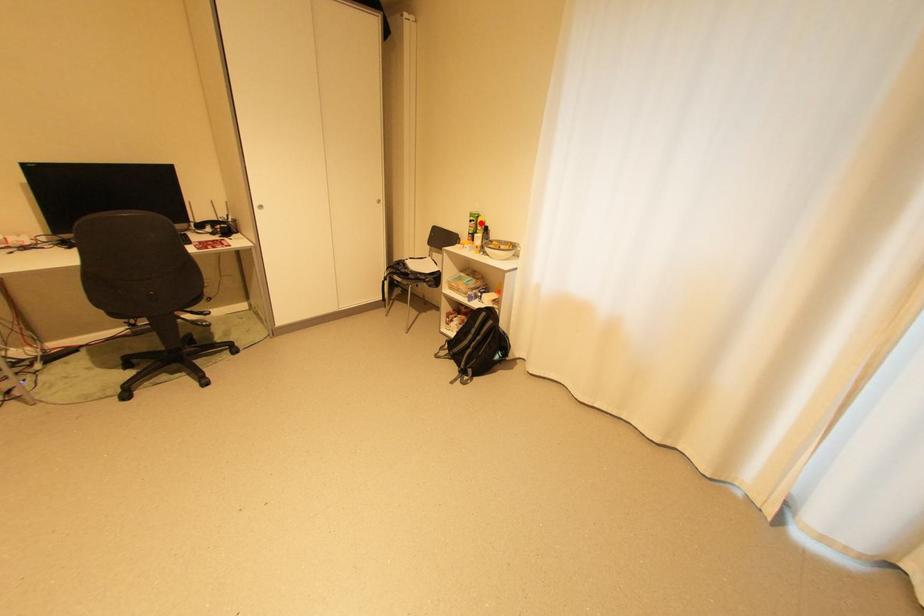
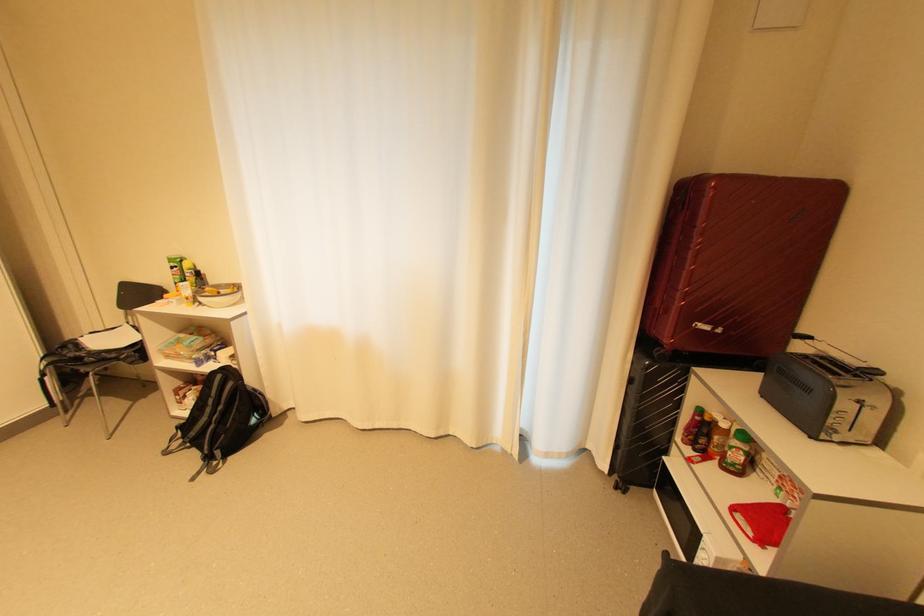
Question: I am providing you with two images of the same scene from different viewpoints. Image1 has a red point marked. In image2, the corresponding 3D location appears at what relative position? Reply with the corresponding letter.

Choices:
 (A) Closer
 (B) Farther

Answer: (B)